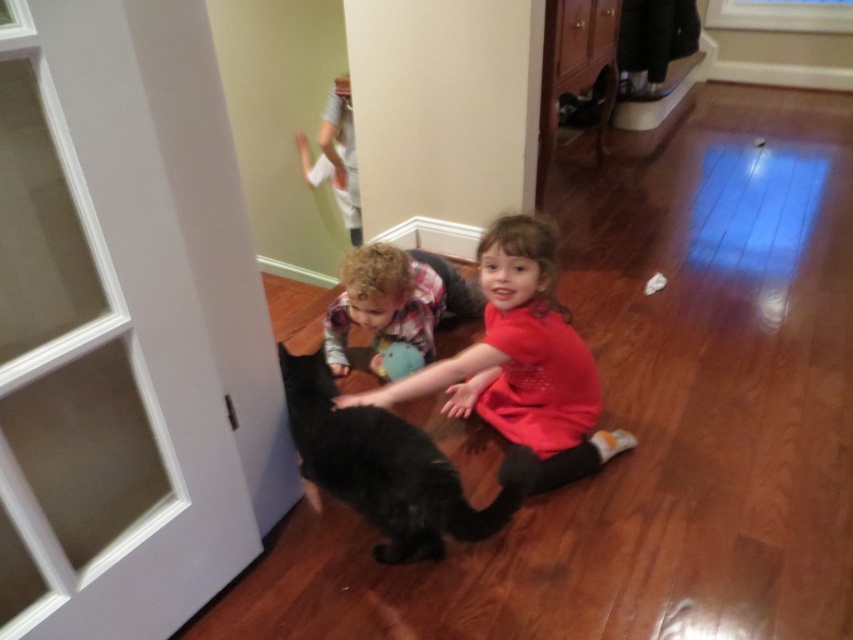
Question: Is matte red shirt at center to the left of matte blue plush at center from the viewer's perspective?

Choices:
 (A) no
 (B) yes

Answer: (A)

Question: Observing the image, what is the correct spatial positioning of matte red shirt at center in reference to black fluffy cat at center?

Choices:
 (A) above
 (B) below

Answer: (A)

Question: Which object appears farthest from the camera in this image?

Choices:
 (A) black fluffy cat at center
 (B) matte red shirt at center

Answer: (B)

Question: Which object appears closest to the camera in this image?

Choices:
 (A) matte blue plush at center
 (B) black fluffy cat at center
 (C) fluffy brown dog at center

Answer: (B)

Question: Which of the following is the farthest from the observer?

Choices:
 (A) matte red shirt at center
 (B) fluffy brown dog at center

Answer: (B)

Question: Considering the relative positions of transparent glass screen door at left and black fluffy cat at center in the image provided, where is transparent glass screen door at left located with respect to black fluffy cat at center?

Choices:
 (A) right
 (B) left

Answer: (B)